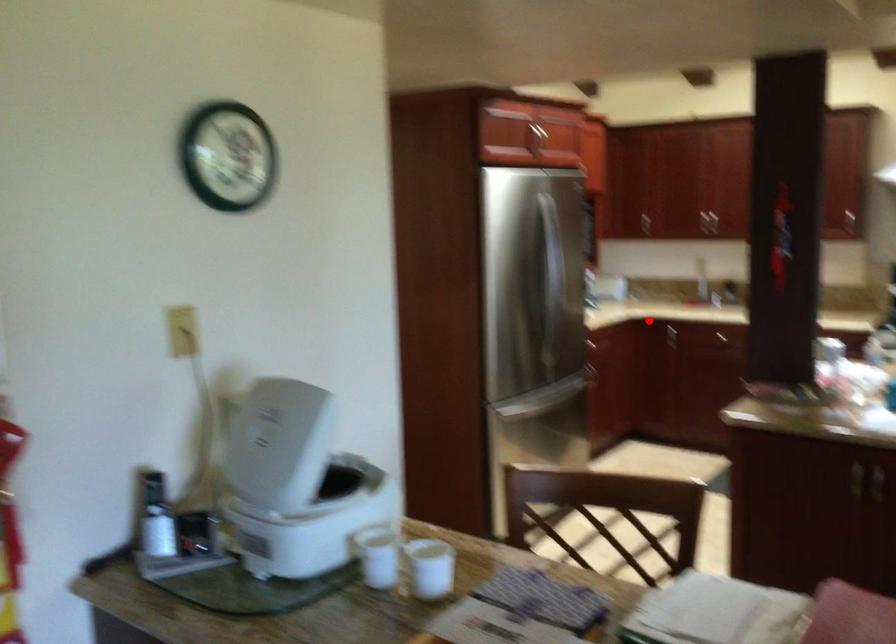
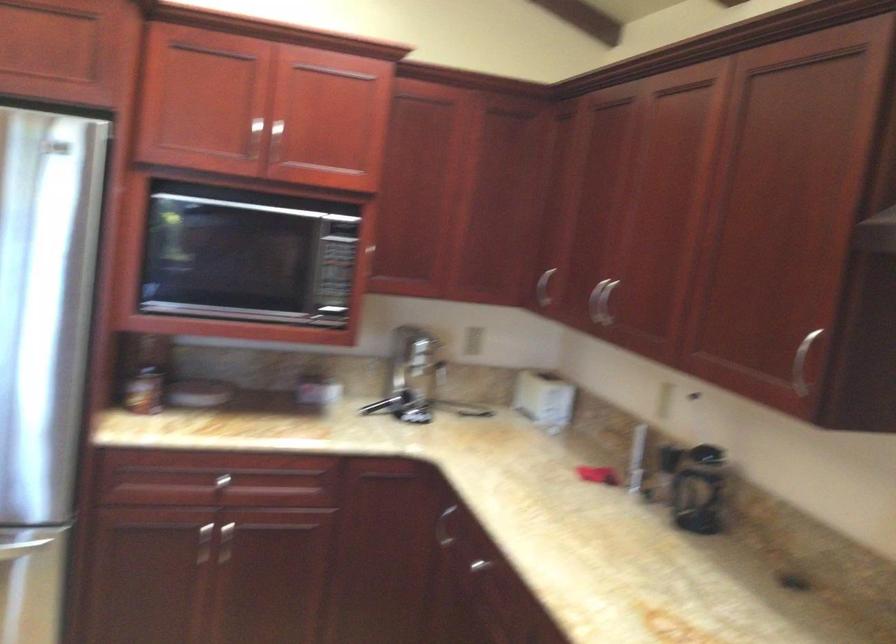
In the second image, find the point that corresponds to the highlighted location in the first image.

(444, 527)